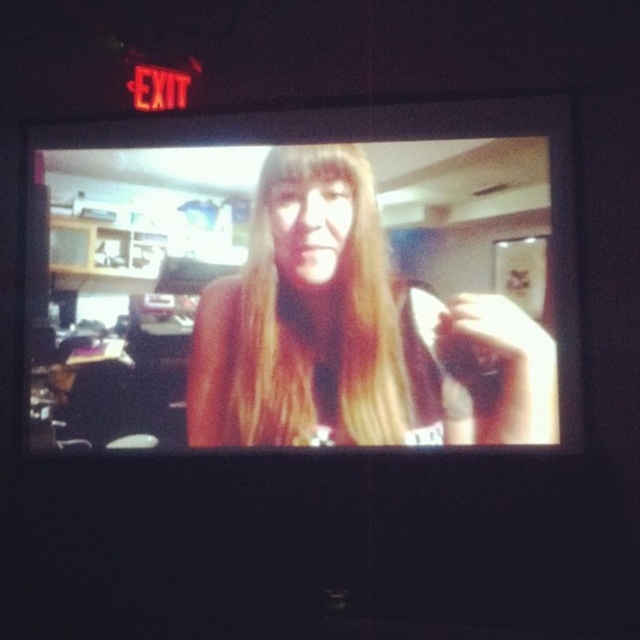
Question: Which point is farther to the camera?

Choices:
 (A) blonde hair at center
 (B) blonde silky hair at center
 (C) smooth skin face at center

Answer: (A)

Question: Is blonde silky hair at center closer to camera compared to blonde hair at center?

Choices:
 (A) no
 (B) yes

Answer: (B)

Question: Does smooth skin face at center have a larger size compared to blonde silky hair at center?

Choices:
 (A) yes
 (B) no

Answer: (A)

Question: Observing the image, what is the correct spatial positioning of blonde silky hair at center in reference to blonde hair at center?

Choices:
 (A) below
 (B) above

Answer: (A)

Question: Which object is the closest to the smooth skin face at center?

Choices:
 (A) blonde silky hair at center
 (B) blonde hair at center

Answer: (A)

Question: Which of these objects is positioned farthest from the blonde silky hair at center?

Choices:
 (A) smooth skin face at center
 (B) blonde hair at center

Answer: (A)